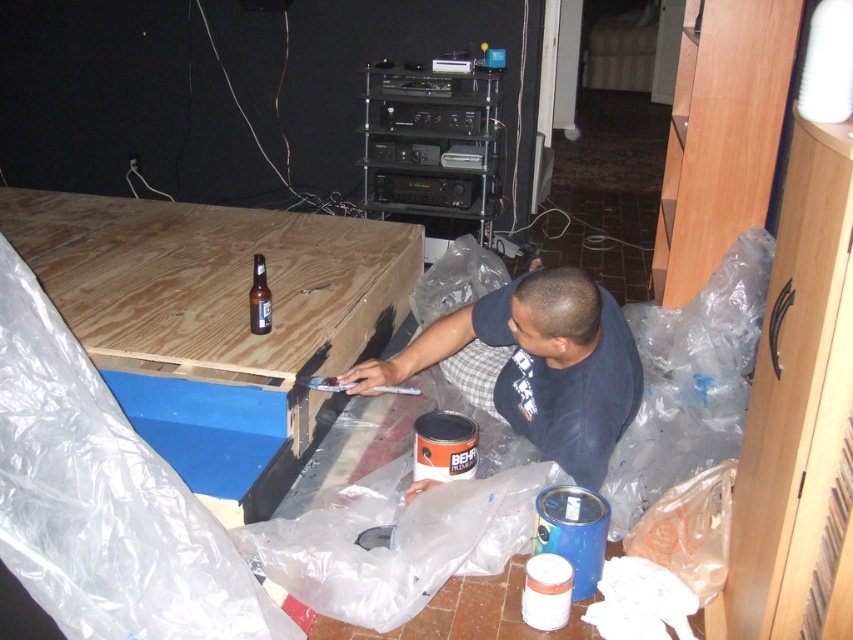
You are a safety inspector checking this workspace. You notice the dark blue shirt at center and the brown glass beer bottle at center. According to safety regulations, which object must be moved to ensure compliance?

The brown glass beer bottle at center must be moved because it is shorter than the dark blue shirt at center, violating safety standards that require all tools and materials to be placed at a height equal to or above the worker.

You are a safety inspector checking the workspace. The dark blue shirt at center and the brown glass beer bottle at center are both at center. According to safety regulations, which object is more likely to be a hazard due to its position and potential to obstruct movement?

The dark blue shirt at center is more likely to be a hazard because it is wider than the brown glass beer bottle at center, potentially obstructing movement more significantly.